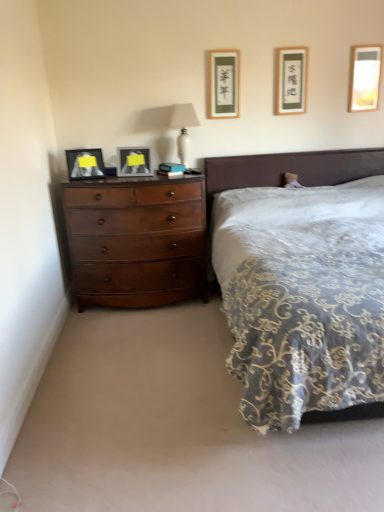
Question: Is matte gold picture frame at upper center, the 3th picture frame viewed from the left, wider than matte glass picture frame at upper right, arranged as the fifth picture frame when viewed from the left?

Choices:
 (A) yes
 (B) no

Answer: (A)

Question: From a real-world perspective, is matte gold picture frame at upper center, the 3th picture frame viewed from the left, beneath matte glass picture frame at upper right, arranged as the fifth picture frame when viewed from the left?

Choices:
 (A) yes
 (B) no

Answer: (B)

Question: Is matte gold picture frame at upper center, which is the third picture frame from right to left, further to camera compared to matte glass picture frame at upper right, positioned as the first picture frame in right-to-left order?

Choices:
 (A) yes
 (B) no

Answer: (B)

Question: Is matte gold picture frame at upper center, which is the third picture frame from right to left, positioned far away from matte glass picture frame at upper right, arranged as the fifth picture frame when viewed from the left?

Choices:
 (A) yes
 (B) no

Answer: (A)

Question: Does matte gold picture frame at upper center, the 3th picture frame viewed from the left, appear on the right side of matte glass picture frame at upper right, arranged as the fifth picture frame when viewed from the left?

Choices:
 (A) yes
 (B) no

Answer: (B)

Question: Is point (84, 174) positioned closer to the camera than point (367, 54)?

Choices:
 (A) closer
 (B) farther

Answer: (A)

Question: From their relative heights in the image, would you say matte black picture frame at left, which is the first picture frame from left to right, is taller or shorter than matte glass picture frame at upper right, positioned as the first picture frame in right-to-left order?

Choices:
 (A) short
 (B) tall

Answer: (A)

Question: From the image's perspective, relative to matte glass picture frame at upper right, arranged as the fifth picture frame when viewed from the left, is matte black picture frame at left, which is the first picture frame from left to right, above or below?

Choices:
 (A) below
 (B) above

Answer: (A)

Question: Is matte black picture frame at left, which is the first picture frame from left to right, wider or thinner than matte glass picture frame at upper right, arranged as the fifth picture frame when viewed from the left?

Choices:
 (A) wide
 (B) thin

Answer: (A)

Question: From their relative heights in the image, would you say white glossy lamp at upper center is taller or shorter than matte glass picture frame at upper right, positioned as the first picture frame in right-to-left order?

Choices:
 (A) short
 (B) tall

Answer: (B)

Question: Is white glossy lamp at upper center wider or thinner than matte glass picture frame at upper right, positioned as the first picture frame in right-to-left order?

Choices:
 (A) thin
 (B) wide

Answer: (B)

Question: Does point (x=173, y=123) appear closer or farther from the camera than point (x=367, y=95)?

Choices:
 (A) closer
 (B) farther

Answer: (A)

Question: In the image, is white glossy lamp at upper center on the left side or the right side of matte glass picture frame at upper right, positioned as the first picture frame in right-to-left order?

Choices:
 (A) left
 (B) right

Answer: (A)

Question: In terms of width, does matte black picture frame at upper center, the 2th picture frame in the right-to-left sequence, look wider or thinner when compared to matte gold picture frame at upper center, the 3th picture frame viewed from the left?

Choices:
 (A) thin
 (B) wide

Answer: (A)

Question: From the image's perspective, is matte black picture frame at upper center, the 2th picture frame in the right-to-left sequence, located above or below matte gold picture frame at upper center, the 3th picture frame viewed from the left?

Choices:
 (A) below
 (B) above

Answer: (B)